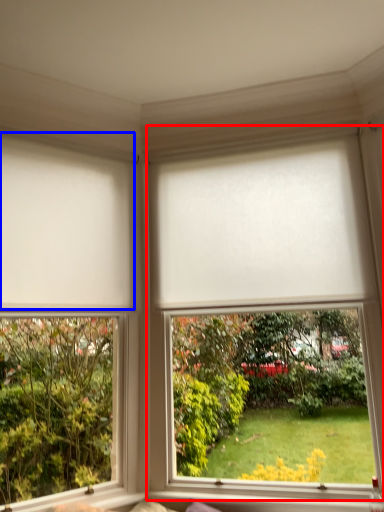
Question: Which object appears farthest to the camera in this image, window (highlighted by a red box) or blind (highlighted by a blue box)?

Choices:
 (A) window
 (B) blind

Answer: (B)